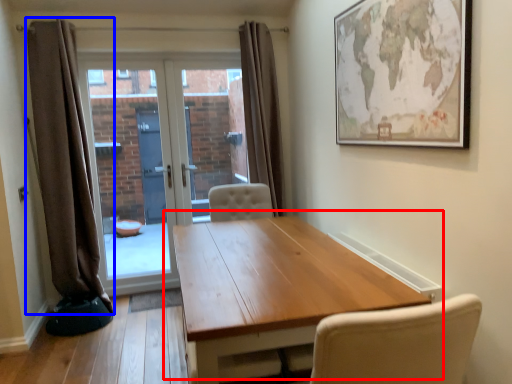
Question: Among these objects, which one is nearest to the camera, table (highlighted by a red box) or curtain (highlighted by a blue box)?

Choices:
 (A) table
 (B) curtain

Answer: (A)